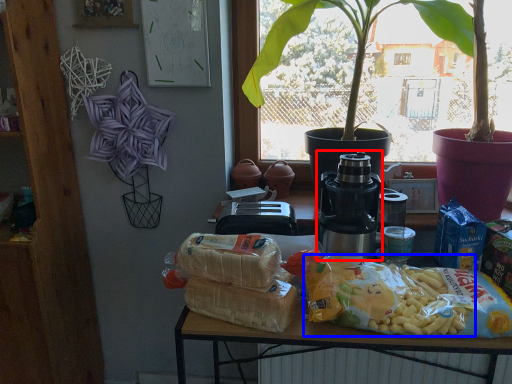
Question: Which point is closer to the camera, yoghurt (highlighted by a red box) or food (highlighted by a blue box)?

Choices:
 (A) yoghurt
 (B) food

Answer: (B)